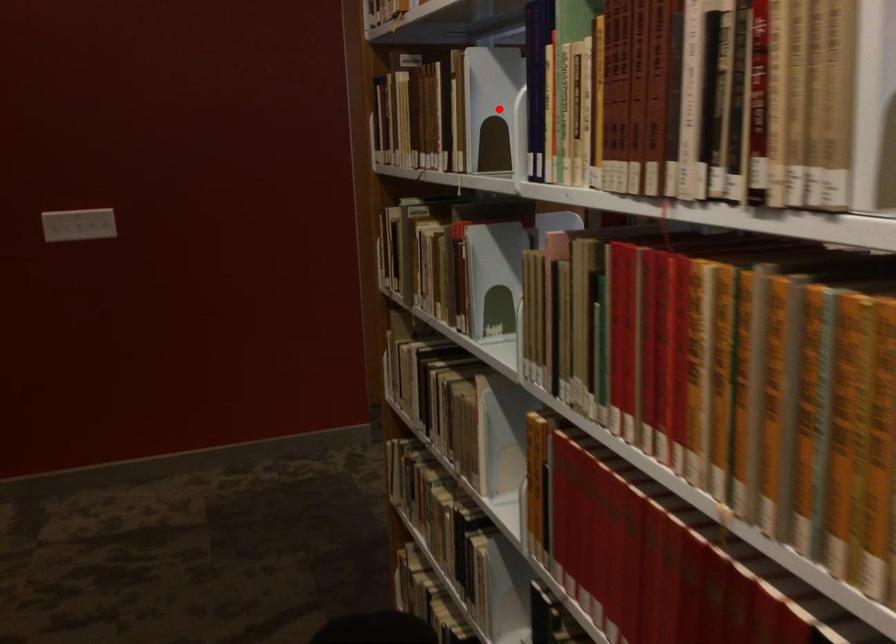
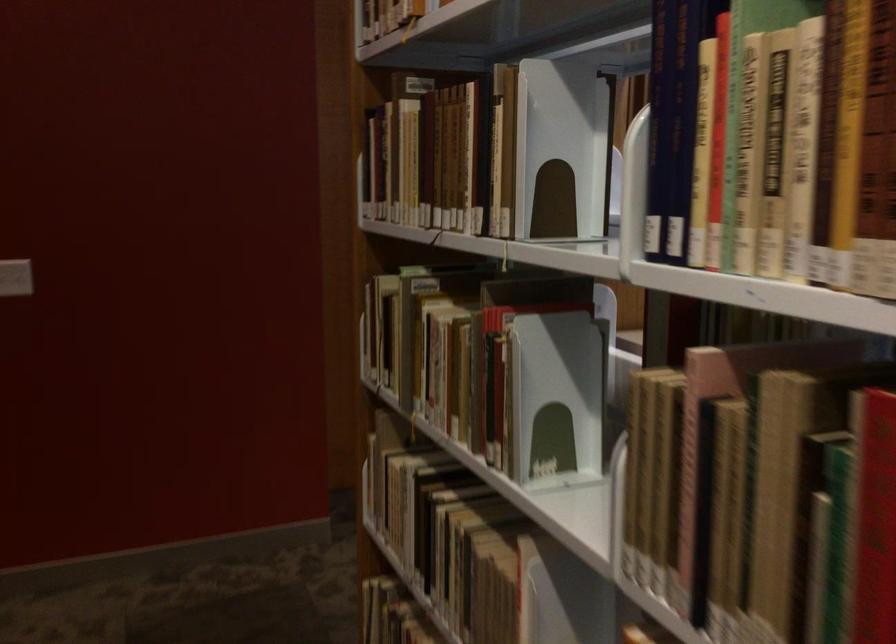
Question: A red point is marked in image1. In image2, is the corresponding 3D point closer to the camera or farther? Reply with the corresponding letter.

Choices:
 (A) The corresponding 3D point is closer.
 (B) The corresponding 3D point is farther.

Answer: (A)